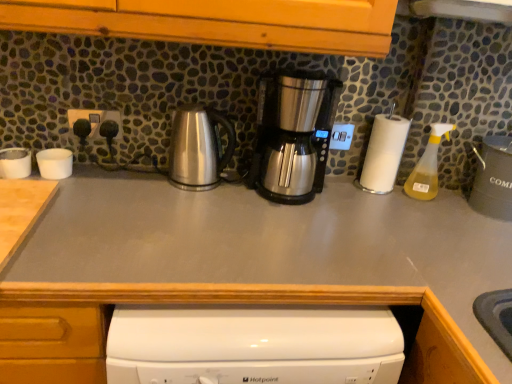
The width and height of the screenshot is (512, 384). Identify the location of vacant area that lies between satin silver kettle at center, marked as the 2th kitchen appliance in a right-to-left arrangement, and stainless steel coffee maker at center, acting as the first kitchen appliance starting from the right. (212, 188).